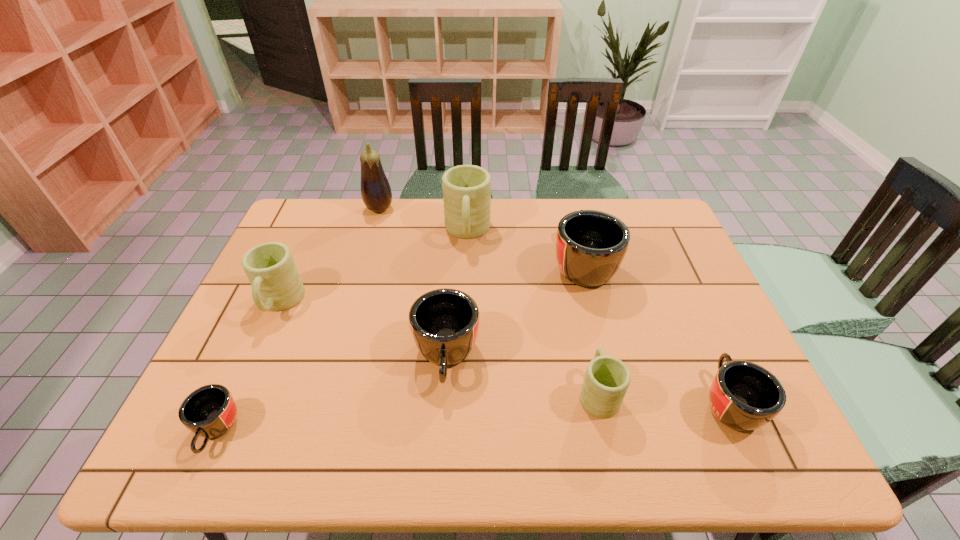
The height and width of the screenshot is (540, 960). In order to click on vacant region between the smallest green mug and the farthest red mug in this screenshot , I will do [590, 328].

This screenshot has width=960, height=540. What are the coordinates of `empty location between the rightmost green mug and the third red mug from left to right` in the screenshot? It's located at click(590, 328).

Identify the location of vacant area between the farthest red mug and the farthest green mug. The height and width of the screenshot is (540, 960). (525, 248).

At what (x,y) coordinates should I click in order to perform the action: click on free space between the third biggest red mug and the seventh shortest object. Please return your answer as a coordinate pair (x, y). Image resolution: width=960 pixels, height=540 pixels. Looking at the image, I should click on (598, 317).

Point out which object is positioned as the nearest to the tallest object. Please provide its 2D coordinates. Your answer should be formatted as a tuple, i.e. [(x, y)], where the tuple contains the x and y coordinates of a point satisfying the conditions above.

[(466, 188)]

Choose which object is the second nearest neighbor to the rightmost object. Please provide its 2D coordinates. Your answer should be formatted as a tuple, i.e. [(x, y)], where the tuple contains the x and y coordinates of a point satisfying the conditions above.

[(590, 245)]

Where is `mug that stands as the second closest to the biggest green mug`? mug that stands as the second closest to the biggest green mug is located at coordinates (444, 323).

Select which mug is the fourth closest to the farthest green mug. Please provide its 2D coordinates. Your answer should be formatted as a tuple, i.e. [(x, y)], where the tuple contains the x and y coordinates of a point satisfying the conditions above.

[(606, 381)]

The image size is (960, 540). In order to click on the closest green mug to the tallest object in this screenshot , I will do `click(466, 188)`.

Image resolution: width=960 pixels, height=540 pixels. In order to click on green mug that is the second closest to the farthest green mug in this screenshot , I will do `click(606, 381)`.